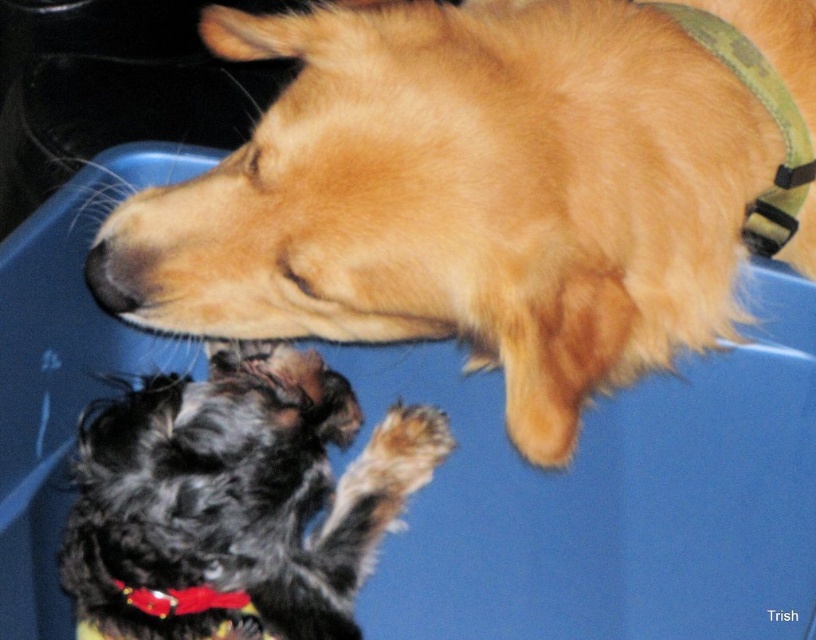
You are a robotic arm trying to pick up two items located at point (645,163) and point (187,518). To avoid collision, which point should you reach first to ensure the robotic arm can safely move from the starting position at the top of the container?

Point (645,163) is in front of point (187,518), so the robotic arm should reach point (645,163) first to avoid collision with the other point during movement.

You are standing at a point 3.38 feet away from the point marked at coordinates point (690, 195). Based on the scene description, can you estimate how far you are from the golden dog with a green collar?

The golden dog with a green collar is positioned above the smaller black and white dog inside the blue plastic container. Since the point marked at coordinates point (690, 195) is 3.38 feet away from the viewer, and the golden dog is part of the scene within the container, the distance from the viewer to the golden dog would also be approximately 3.38 feet.

You are a vet examining the dogs in the blue container. The golden fur dog at upper center and the red fabric neckband at lower center are both visible. Which object is taller?

The golden fur dog at upper center is taller than the red fabric neckband at lower center.